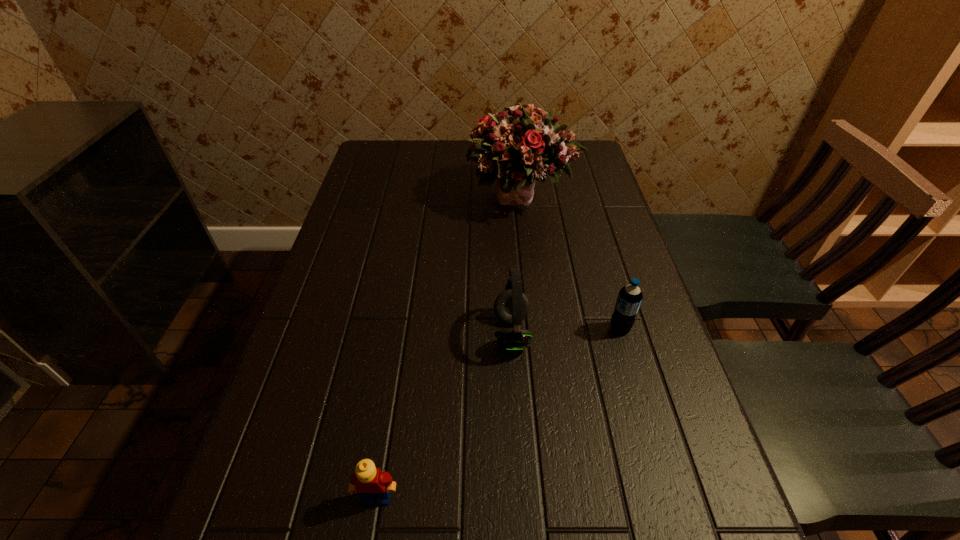
What are the coordinates of `free space that is in between the soda bottle and the leftmost object` in the screenshot? It's located at (498, 413).

Where is `free spot between the soda bottle and the shortest object`? free spot between the soda bottle and the shortest object is located at coordinates (498, 413).

The width and height of the screenshot is (960, 540). Find the location of `free point between the tallest object and the leftmost object`. free point between the tallest object and the leftmost object is located at coordinates (449, 347).

Find the location of a particular element. empty space between the soda bottle and the leftmost object is located at coordinates (498, 413).

Locate an element on the screen. The image size is (960, 540). free point between the soda bottle and the leftmost object is located at coordinates (498, 413).

I want to click on free space between the bouquet and the headset, so click(516, 265).

Find the location of `free space between the farthest object and the Lego`. free space between the farthest object and the Lego is located at coordinates click(x=449, y=347).

Where is `vacant space that is in between the headset and the soda bottle`? Image resolution: width=960 pixels, height=540 pixels. vacant space that is in between the headset and the soda bottle is located at coordinates (565, 331).

This screenshot has width=960, height=540. In order to click on vacant space that's between the soda bottle and the headset in this screenshot , I will do (x=565, y=331).

At what (x,y) coordinates should I click in order to perform the action: click on the closest object to the headset. Please return your answer as a coordinate pair (x, y). The image size is (960, 540). Looking at the image, I should click on (629, 299).